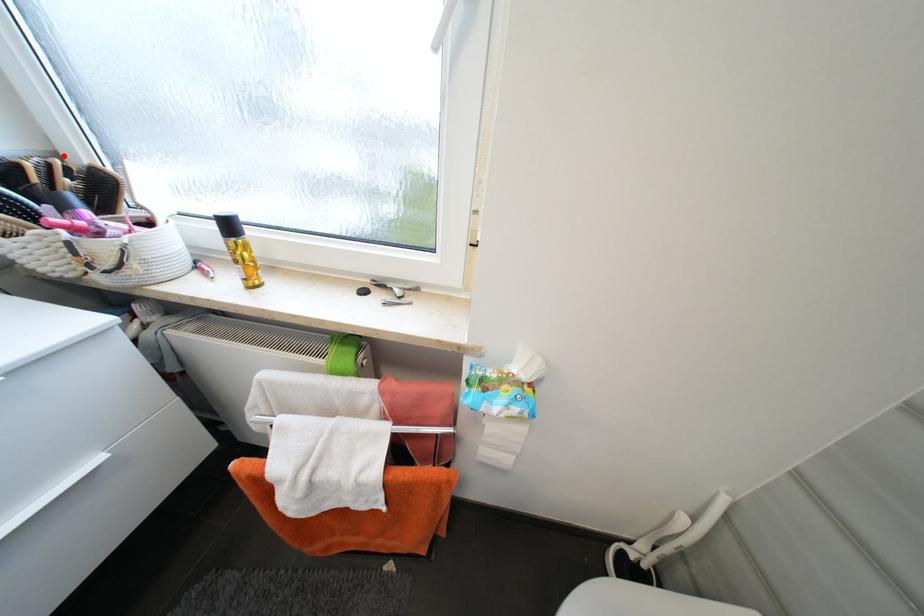
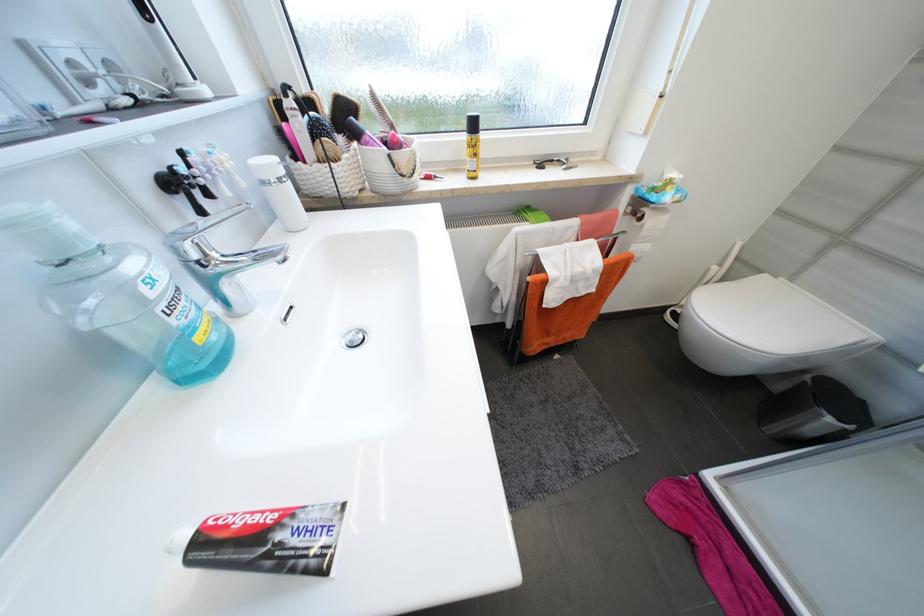
In the second image, find the point that corresponds to the highlighted location in the first image.

(280, 92)